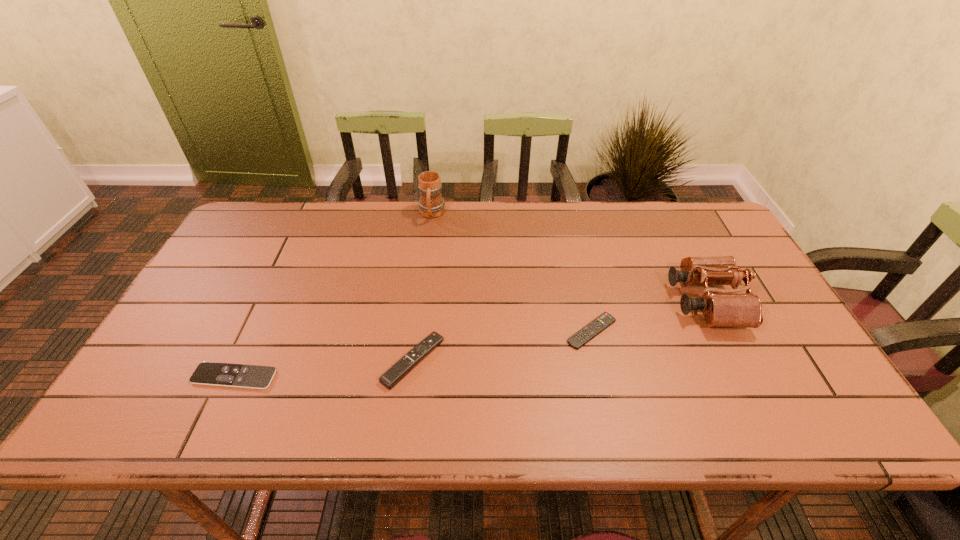
The width and height of the screenshot is (960, 540). Find the location of `free space located on the right of the tallest remote control`. free space located on the right of the tallest remote control is located at coordinates (471, 361).

Where is `blank area located 0.140m on the left of the second object from right to left`? This screenshot has height=540, width=960. blank area located 0.140m on the left of the second object from right to left is located at coordinates (511, 331).

What are the coordinates of `free location located on the right of the leftmost object` in the screenshot? It's located at (391, 376).

Find the location of `object positioned at the far edge`. object positioned at the far edge is located at coordinates (431, 204).

Locate an element on the screen. The image size is (960, 540). object situated at the left edge is located at coordinates (207, 373).

Locate an element on the screen. object at the right edge is located at coordinates (728, 308).

Locate an element on the screen. free spot at the far edge of the desktop is located at coordinates (490, 242).

Image resolution: width=960 pixels, height=540 pixels. What are the coordinates of `blank space at the near edge of the desktop` in the screenshot? It's located at (673, 411).

Find the location of a particular element. The height and width of the screenshot is (540, 960). vacant area at the left edge is located at coordinates (166, 379).

The height and width of the screenshot is (540, 960). Find the location of `vacant space at the right edge of the desktop`. vacant space at the right edge of the desktop is located at coordinates (767, 334).